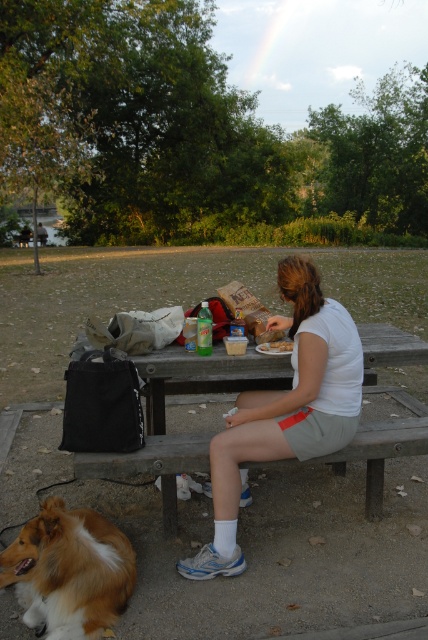
Can you confirm if wooden picnic table at center is wider than smooth plastic container at center?

Indeed, wooden picnic table at center has a greater width compared to smooth plastic container at center.

Is wooden picnic table at center bigger than smooth plastic container at center?

Indeed, wooden picnic table at center has a larger size compared to smooth plastic container at center.

This screenshot has height=640, width=428. I want to click on wooden picnic table at center, so click(x=165, y=417).

Does point (124, 465) lie in front of point (103, 593)?

No, it is not.

Can you confirm if wooden picnic table at center is shorter than golden fur dog at lower left?

Yes.

At what (x,y) coordinates should I click in order to perform the action: click on wooden picnic table at center. Please return your answer as a coordinate pair (x, y). The height and width of the screenshot is (640, 428). Looking at the image, I should click on tap(165, 417).

The height and width of the screenshot is (640, 428). What do you see at coordinates (70, 572) in the screenshot?
I see `golden fur dog at lower left` at bounding box center [70, 572].

Is golden fur dog at lower left positioned in front of smooth plastic container at center?

Yes.

Image resolution: width=428 pixels, height=640 pixels. Describe the element at coordinates (70, 572) in the screenshot. I see `golden fur dog at lower left` at that location.

Where is `golden fur dog at lower left`? Image resolution: width=428 pixels, height=640 pixels. golden fur dog at lower left is located at coordinates (70, 572).